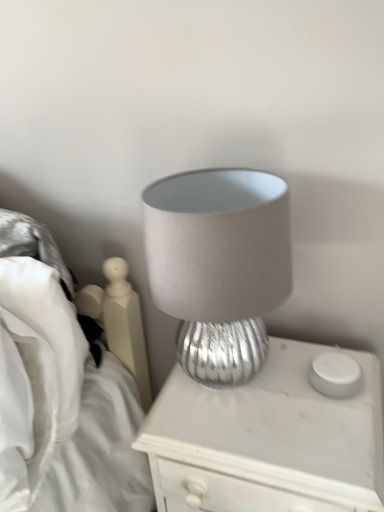
Identify the location of free region on the left part of white matte candle holder at right. This screenshot has height=512, width=384. (259, 394).